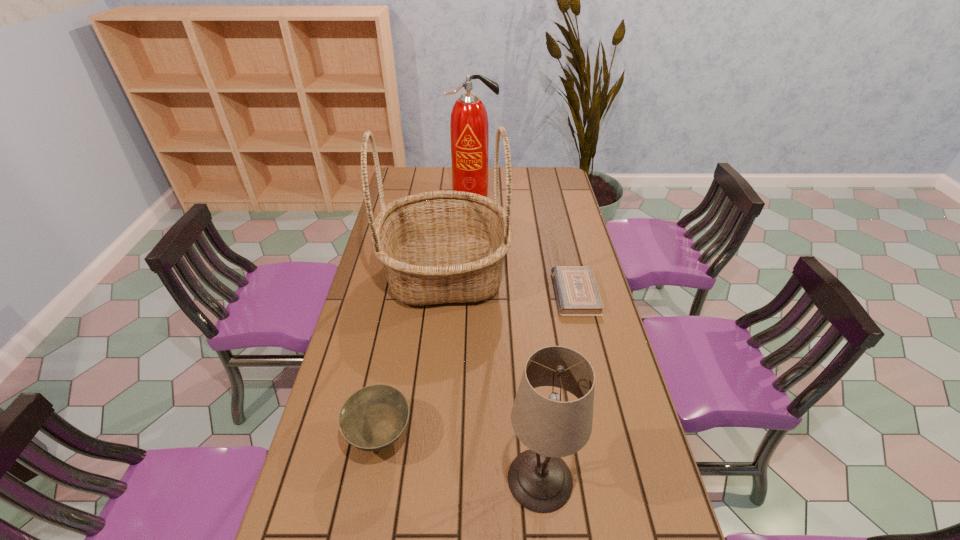
This screenshot has height=540, width=960. Identify the location of vacant point located between the bowl and the third tallest object. (460, 458).

Where is `empty location between the farthest object and the rightmost object`? empty location between the farthest object and the rightmost object is located at coordinates (524, 244).

Locate an element on the screen. object that can be found as the closest to the Bible is located at coordinates (436, 247).

Where is `object that is the second closest to the second shortest object`? object that is the second closest to the second shortest object is located at coordinates (436, 247).

Find the location of `free spot that satisfies the following two spatial constraints: 1. on the back side of the farthest object; 2. on the right side of the bowl`. free spot that satisfies the following two spatial constraints: 1. on the back side of the farthest object; 2. on the right side of the bowl is located at coordinates (424, 194).